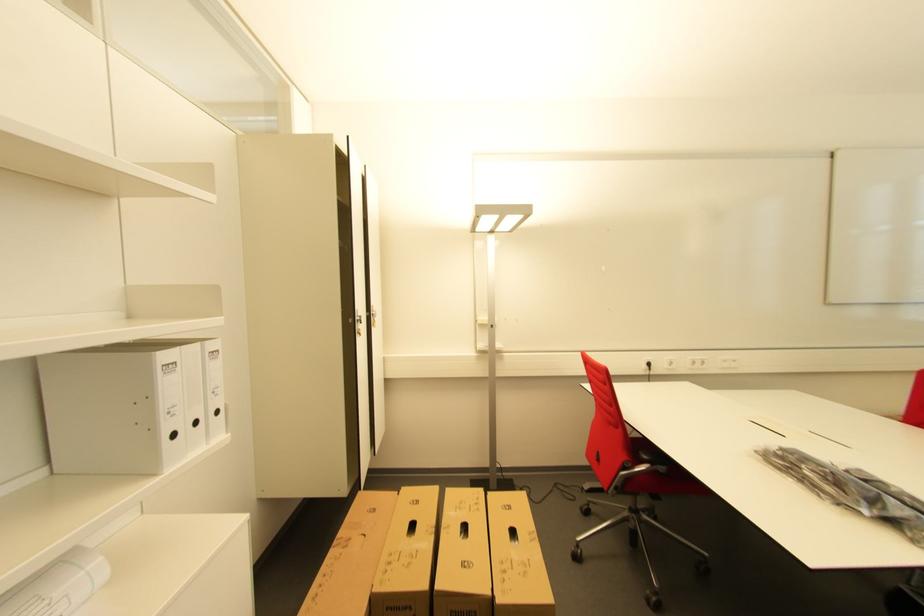
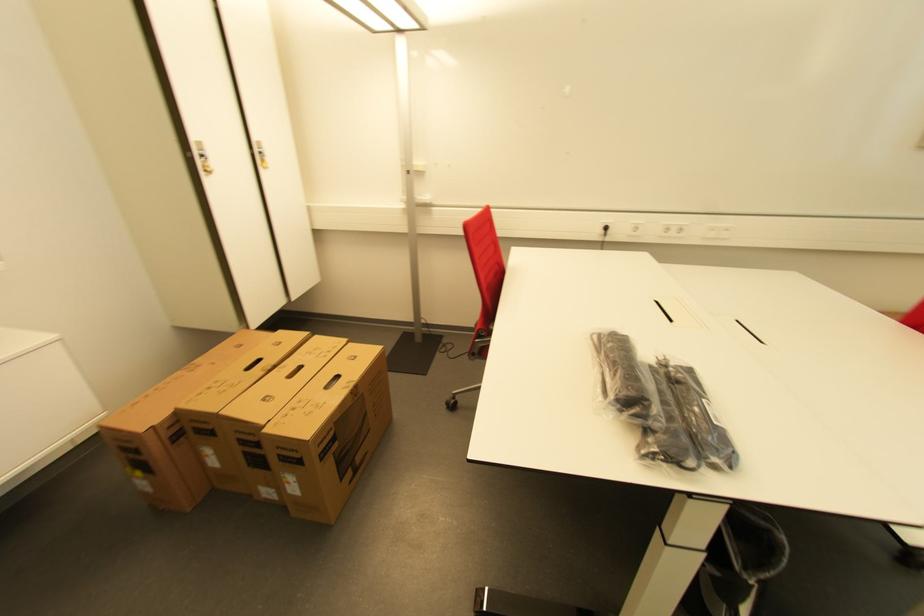
Find the pixel in the second image that matches the point at 654,365 in the first image.

(611, 230)